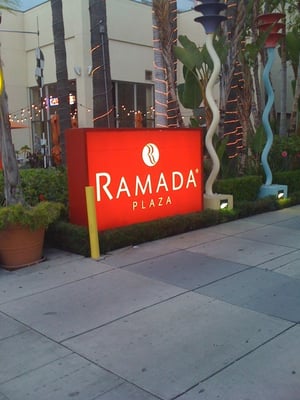
At what (x,y) coordinates should I click in order to perform the action: click on hotel. Please return your answer as a coordinate pair (x, y). Looking at the image, I should click on click(x=115, y=58).